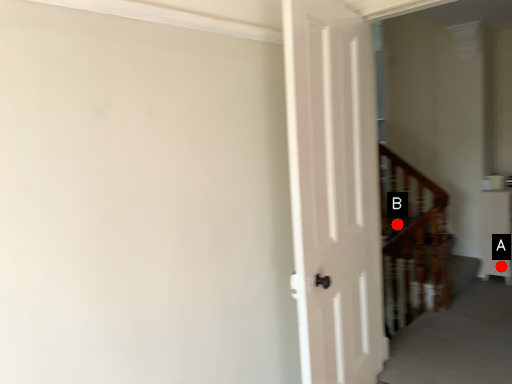
Question: Two points are circled on the image, labeled by A and B beside each circle. Which point is farther from the camera taking this photo?

Choices:
 (A) A is further
 (B) B is further

Answer: (B)